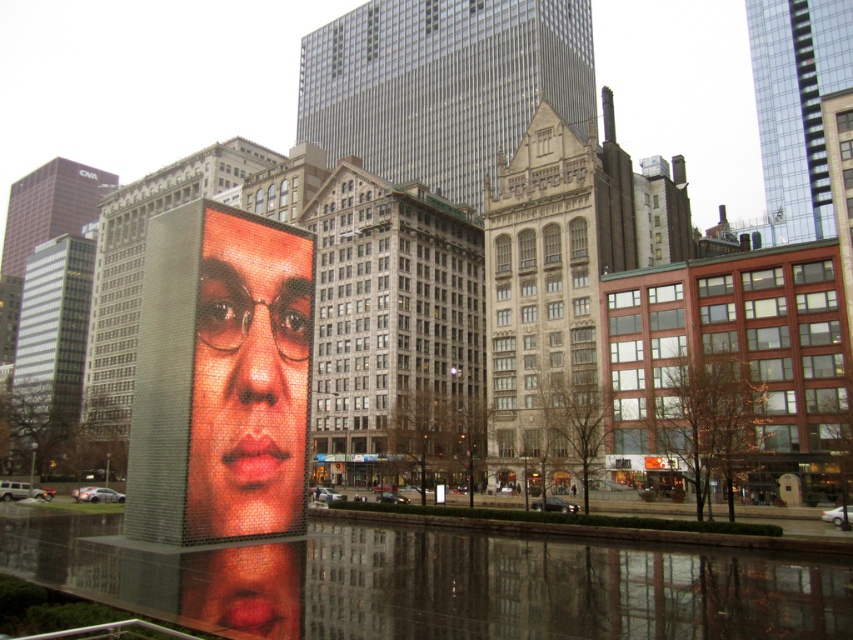
You are an architect analyzing the urban layout. You need to determine which object occupies more horizontal space in the image. Based on the scene, which one is wider between the reflective glass water at center and the polished mosaic face at center?

The reflective glass water at center is wider than the polished mosaic face at center according to the description.

You are a photographer positioned at the camera location. You want to take a photo of both point (68, 554) and point (231, 476). Which point will appear larger in your photo?

Point (68, 554) is closer to the camera than point (231, 476), so it will appear larger in the photo.